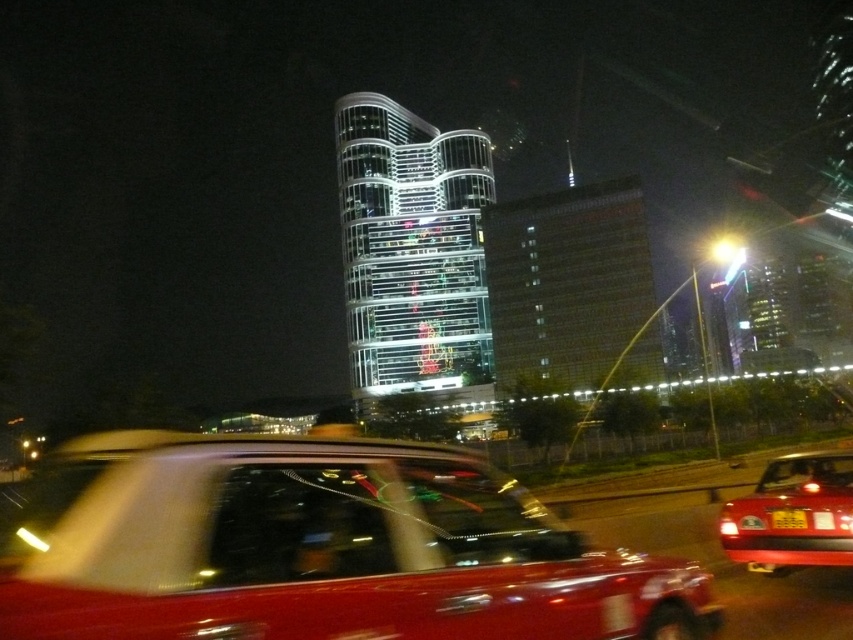
Question: Is shiny red taxi at center further to the viewer compared to glassy reflective building at center?

Choices:
 (A) no
 (B) yes

Answer: (A)

Question: Which point is farther from the camera taking this photo?

Choices:
 (A) (779, 516)
 (B) (633, 179)

Answer: (B)

Question: Which point is farther to the camera?

Choices:
 (A) glassy reflective building at center
 (B) shiny red taxi at center

Answer: (A)

Question: Can you confirm if shiny red taxi at center is wider than shiny glass tower at center?

Choices:
 (A) yes
 (B) no

Answer: (A)

Question: Can you confirm if glassy reflective building at center is positioned below yellow matte license plate at center?

Choices:
 (A) no
 (B) yes

Answer: (A)

Question: Which point is closer to the camera?

Choices:
 (A) (543, 323)
 (B) (405, 296)

Answer: (A)